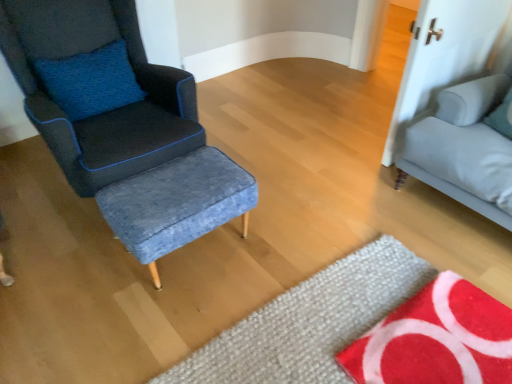
At what (x,y) coordinates should I click in order to perform the action: click on free region under denim fabric stool at center (from a real-world perspective). Please return your answer as a coordinate pair (x, y). Looking at the image, I should click on (196, 255).